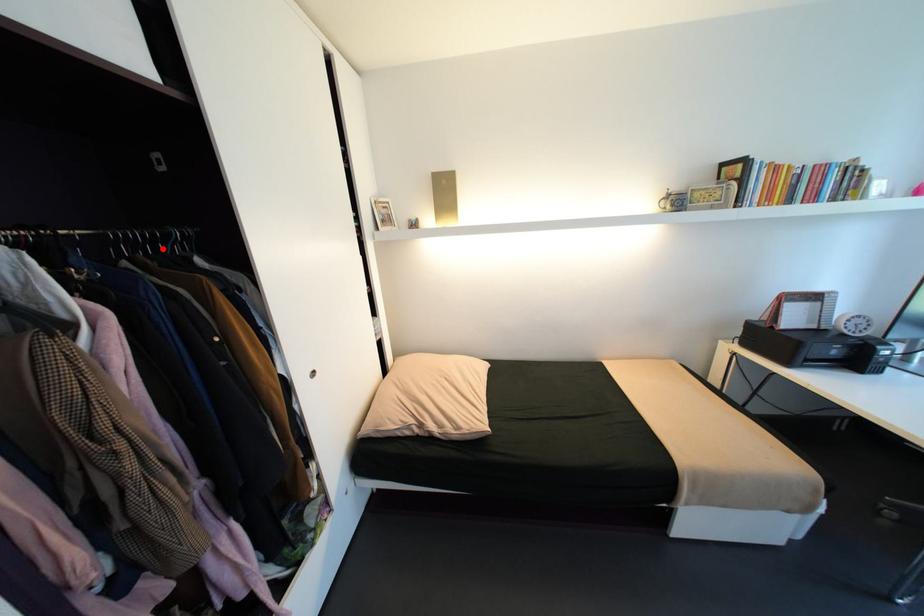
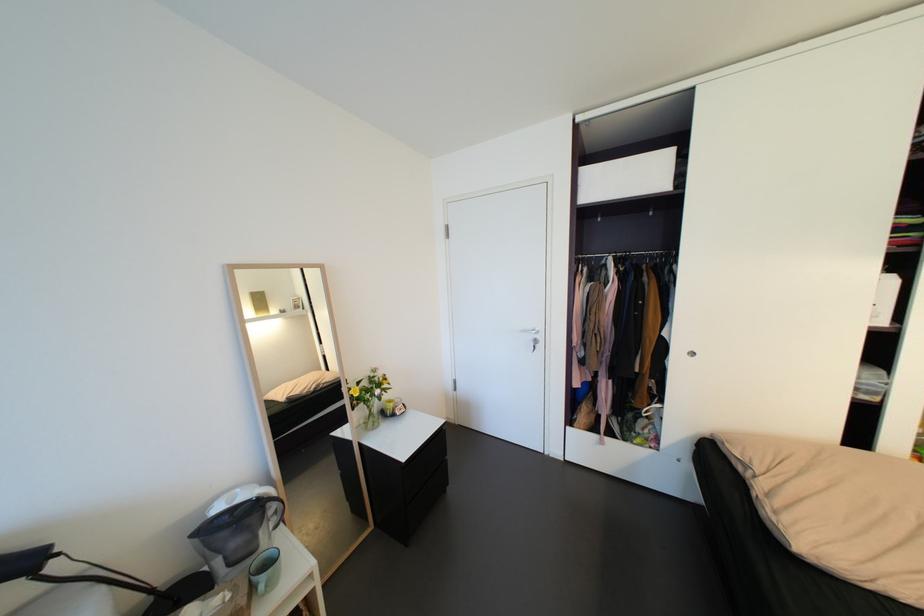
Locate, in the second image, the point that corresponds to the highlighted location in the first image.

(667, 261)